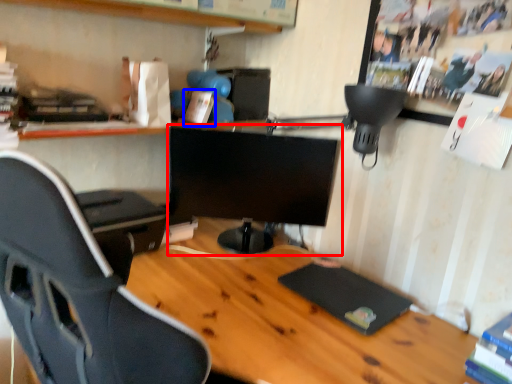
Question: Which object is further to the camera taking this photo, computer monitor (highlighted by a red box) or book (highlighted by a blue box)?

Choices:
 (A) computer monitor
 (B) book

Answer: (B)